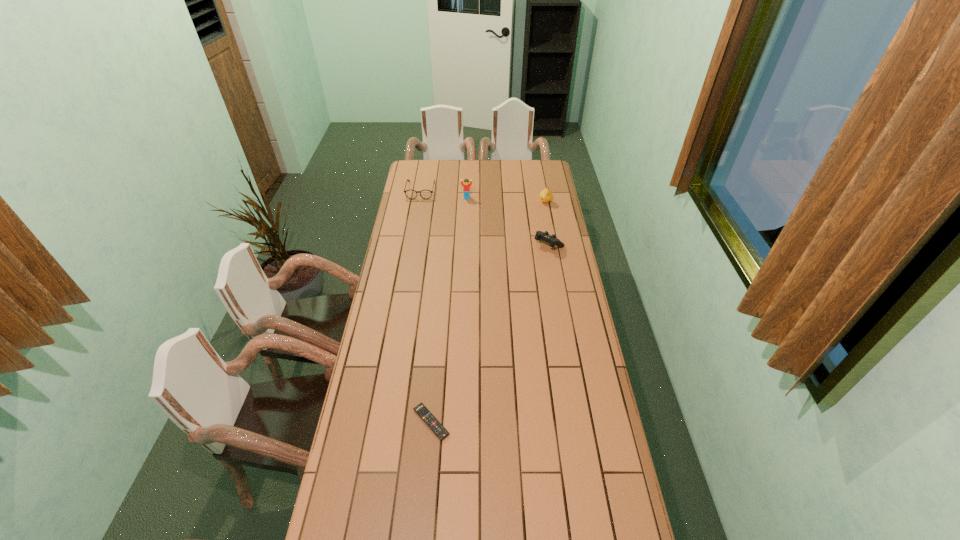
I want to click on vacant region located on the right of the nearest object, so click(570, 422).

Image resolution: width=960 pixels, height=540 pixels. Find the location of `object that is at the left edge`. object that is at the left edge is located at coordinates (411, 194).

Where is `pear that is at the right edge`? This screenshot has height=540, width=960. pear that is at the right edge is located at coordinates (546, 195).

Find the location of `control that is at the right edge`. control that is at the right edge is located at coordinates (552, 240).

Find the location of a particular element. blank space at the far edge is located at coordinates (514, 168).

Where is `vacant space at the left edge of the desktop`? This screenshot has width=960, height=540. vacant space at the left edge of the desktop is located at coordinates [421, 258].

This screenshot has width=960, height=540. Find the location of `free space at the right edge of the desktop`. free space at the right edge of the desktop is located at coordinates (575, 359).

In the image, there is a desktop. Identify the location of free space at the far left corner. This screenshot has height=540, width=960. (434, 161).

This screenshot has height=540, width=960. I want to click on vacant point located between the control and the remote control, so click(x=490, y=333).

This screenshot has width=960, height=540. What are the coordinates of `free space between the nearest object and the tallest object` in the screenshot? It's located at (449, 310).